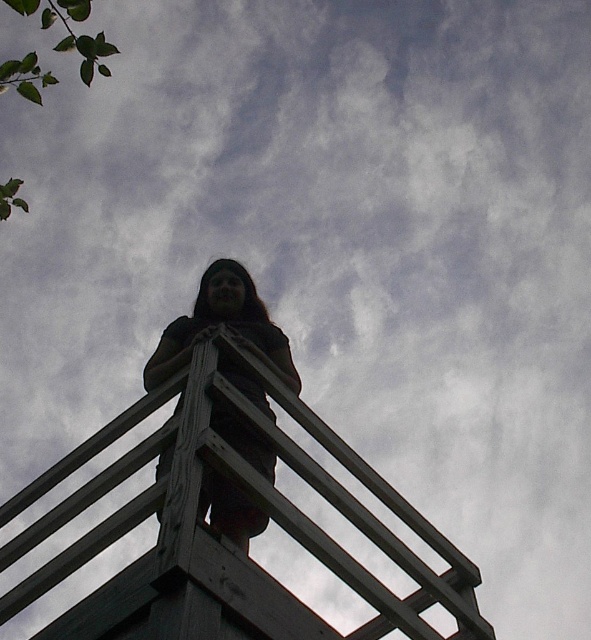
You are a photographer trying to capture a clear shot of the dark brown leather jacket at center. However, the wooden rail at center is blocking your view. Can you adjust your position to see the jacket without the rail obstructing it?

The wooden rail at center is in front of the dark brown leather jacket at center, so moving your camera position slightly to the side or angle might allow you to see the jacket without the rail blocking it.

You are standing at the base of the wooden structure and want to place a small decorative item exactly where the wooden rail at center is located. What are the coordinates where you should place it?

The wooden rail at center should be placed at coordinates (228, 540) as specified in the description.